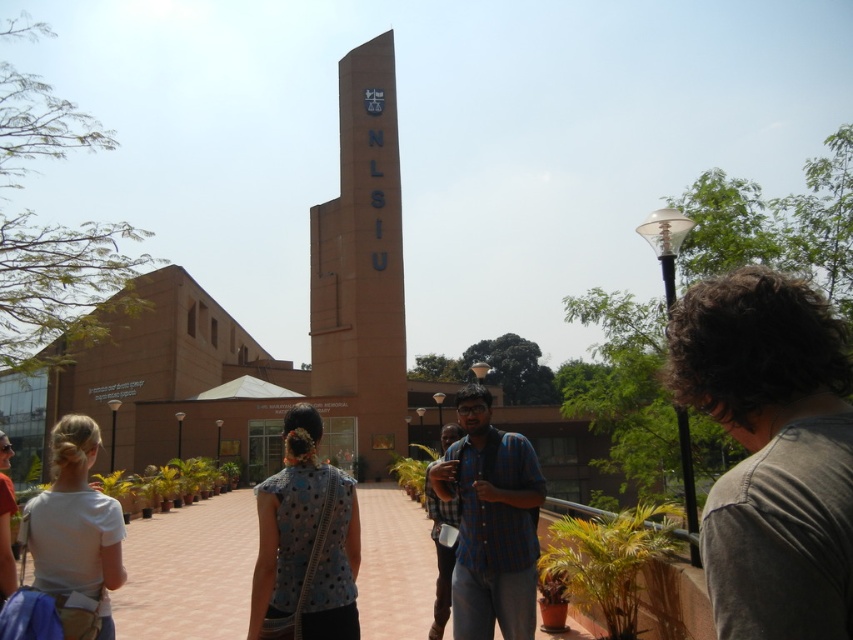
You are a photographer standing at the edge of the pathway in the scene. You want to capture both the brown matte tower at center and the blue dotted blouse at center in a single frame. Since the tower is taller, where should you position your camera to ensure both are fully visible?

The brown matte tower at center is taller than the blue dotted blouse at center. To capture both fully, position the camera lower so the tower doesn

You are standing at the entrance of NLSIU and see the brown matte tower at center and the white matte shirt at lower left. Which object is located to the right of the other?

The brown matte tower at center is positioned on the right side of white matte shirt at lower left.